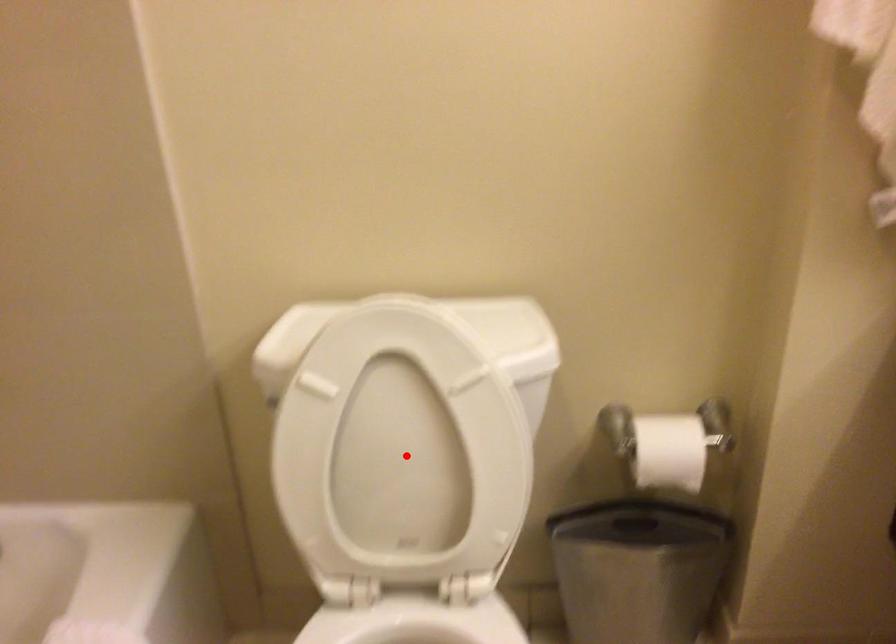
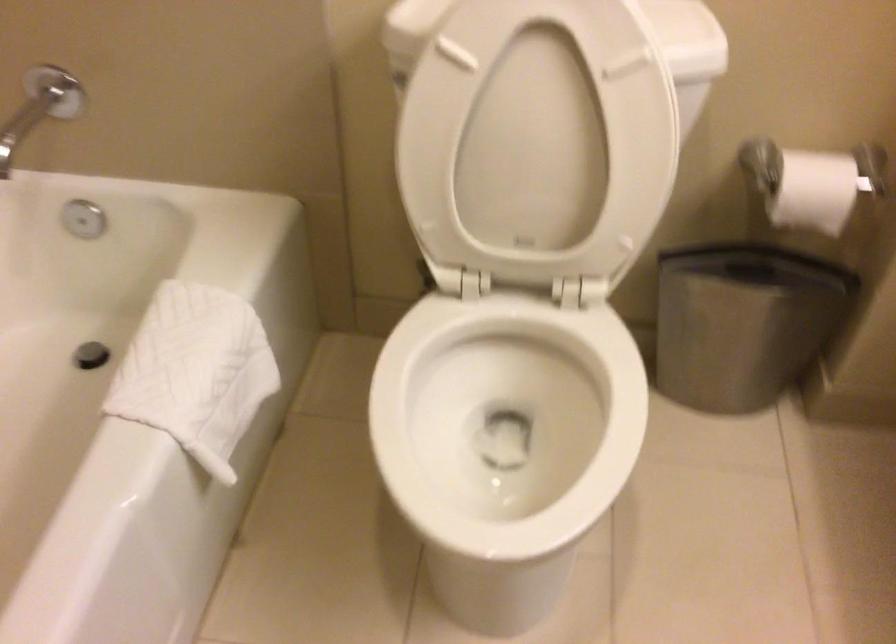
The point at the highlighted location is marked in the first image. Where is the corresponding point in the second image?

(538, 140)